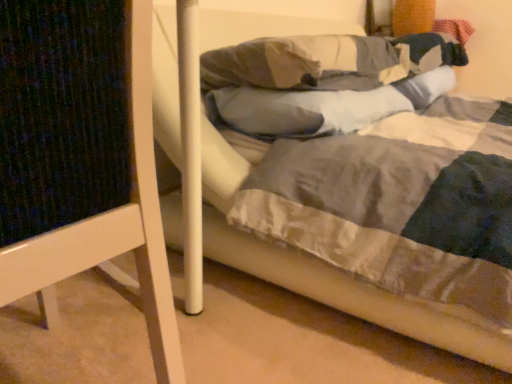
Question: Can you confirm if white wood bed frame at left is positioned to the left of white soft pillow at center, the 1th pillow viewed from the top?

Choices:
 (A) yes
 (B) no

Answer: (A)

Question: Considering the relative positions of white wood bed frame at left and white soft pillow at center, arranged as the 2th pillow when ordered from the bottom, in the image provided, is white wood bed frame at left behind white soft pillow at center, arranged as the 2th pillow when ordered from the bottom,?

Choices:
 (A) yes
 (B) no

Answer: (B)

Question: Is white wood bed frame at left directly adjacent to white soft pillow at center, the 1th pillow viewed from the top?

Choices:
 (A) no
 (B) yes

Answer: (A)

Question: Is white wood bed frame at left facing towards white soft pillow at center, arranged as the 2th pillow when ordered from the bottom?

Choices:
 (A) yes
 (B) no

Answer: (B)

Question: Does white wood bed frame at left have a larger size compared to white soft pillow at center, the 1th pillow viewed from the top?

Choices:
 (A) yes
 (B) no

Answer: (A)

Question: Considering the relative sizes of white wood bed frame at left and white soft pillow at center, the 1th pillow viewed from the top, in the image provided, is white wood bed frame at left thinner than white soft pillow at center, the 1th pillow viewed from the top,?

Choices:
 (A) yes
 (B) no

Answer: (B)

Question: Does gray soft pillow at center, which is the 1th pillow from bottom to top, appear on the right side of white soft pillow at center, arranged as the 2th pillow when ordered from the bottom?

Choices:
 (A) no
 (B) yes

Answer: (B)

Question: Can you see gray soft pillow at center, which is the 1th pillow from bottom to top, touching white soft pillow at center, the 1th pillow viewed from the top?

Choices:
 (A) yes
 (B) no

Answer: (A)

Question: Considering the relative sizes of gray soft pillow at center, which is the 1th pillow from bottom to top, and white soft pillow at center, the 1th pillow viewed from the top, in the image provided, is gray soft pillow at center, which is the 1th pillow from bottom to top, thinner than white soft pillow at center, the 1th pillow viewed from the top,?

Choices:
 (A) yes
 (B) no

Answer: (A)

Question: Is gray soft pillow at center, the second pillow from the top, wider than white soft pillow at center, the 1th pillow viewed from the top?

Choices:
 (A) yes
 (B) no

Answer: (B)

Question: Is gray soft pillow at center, which is the 1th pillow from bottom to top, positioned before white soft pillow at center, the 1th pillow viewed from the top?

Choices:
 (A) no
 (B) yes

Answer: (A)

Question: Does gray soft pillow at center, which is the 1th pillow from bottom to top, have a greater height compared to white soft pillow at center, the 1th pillow viewed from the top?

Choices:
 (A) no
 (B) yes

Answer: (A)

Question: Does gray soft pillow at center, the second pillow from the top, have a greater width compared to white wood bed frame at left?

Choices:
 (A) no
 (B) yes

Answer: (A)